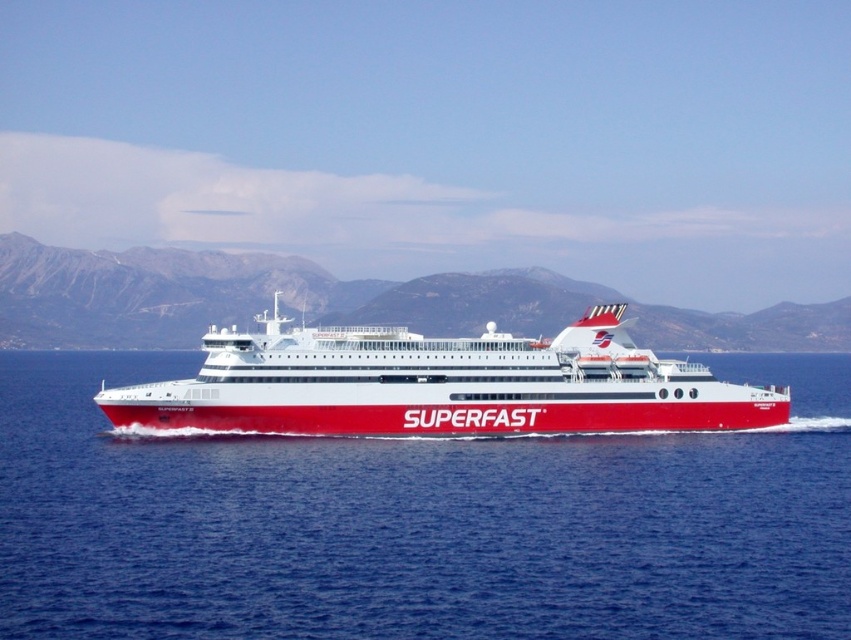
Is red glossy water at center taller than gray rocky mountain at center?

Incorrect, red glossy water at center's height is not larger of gray rocky mountain at center's.

Does red glossy water at center appear under gray rocky mountain at center?

Yes, red glossy water at center is below gray rocky mountain at center.

Locate an element on the screen. The image size is (851, 640). red glossy water at center is located at coordinates (418, 522).

Where is `red glossy water at center`? red glossy water at center is located at coordinates (418, 522).

Is white glossy cruise ship at center thinner than gray rocky mountain at center?

Indeed, white glossy cruise ship at center has a lesser width compared to gray rocky mountain at center.

Is point (698, 424) behind point (672, 312)?

No, it is in front of (672, 312).

Is point (701, 396) more distant than point (532, 332)?

No, (701, 396) is in front of (532, 332).

Image resolution: width=851 pixels, height=640 pixels. I want to click on white glossy cruise ship at center, so click(x=441, y=385).

Does red glossy water at center appear on the right side of white glossy cruise ship at center?

Correct, you'll find red glossy water at center to the right of white glossy cruise ship at center.

In the scene shown: Does red glossy water at center have a lesser width compared to white glossy cruise ship at center?

No, red glossy water at center is not thinner than white glossy cruise ship at center.

Image resolution: width=851 pixels, height=640 pixels. What do you see at coordinates (418, 522) in the screenshot? I see `red glossy water at center` at bounding box center [418, 522].

Find the location of a particular element. The width and height of the screenshot is (851, 640). red glossy water at center is located at coordinates (418, 522).